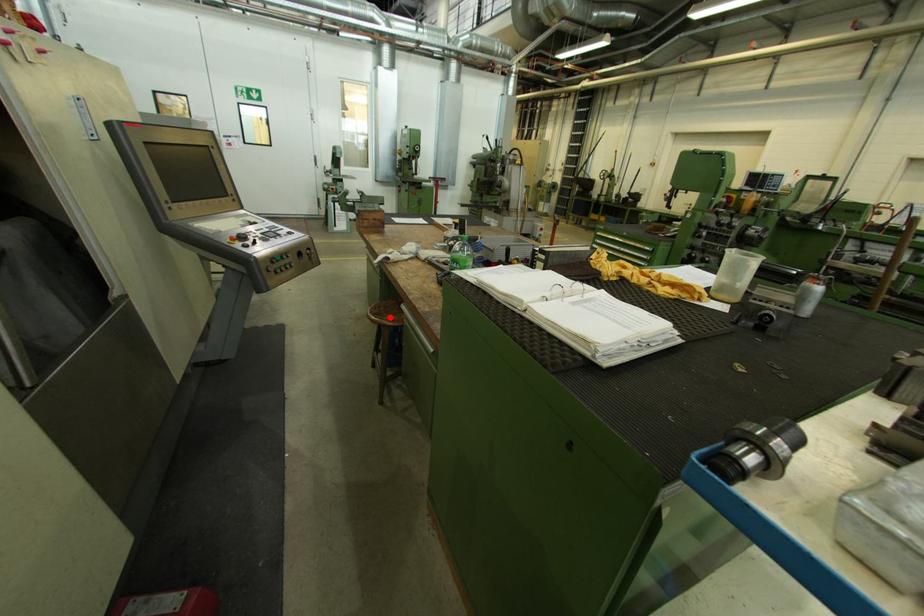
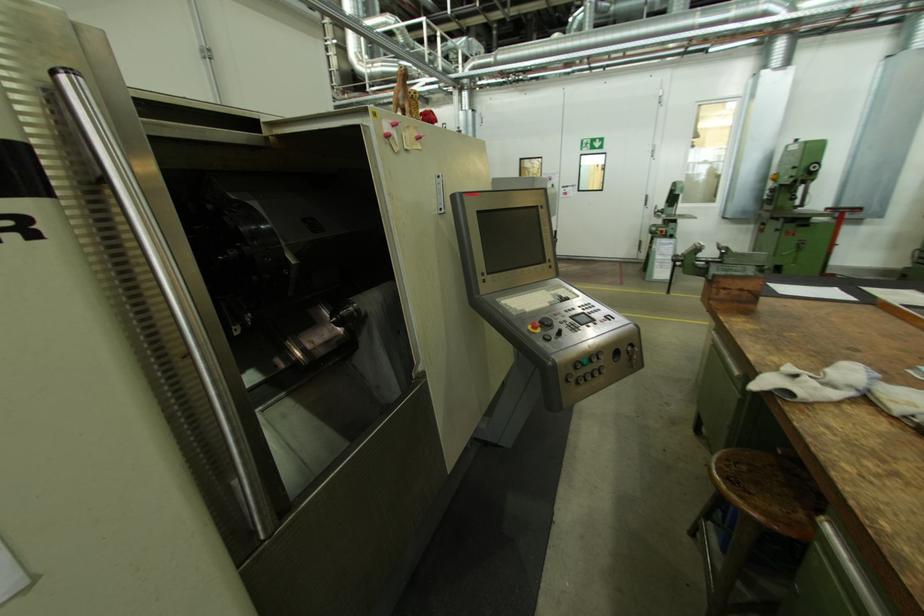
Find the pixel in the second image that matches the highlighted location in the first image.

(755, 493)